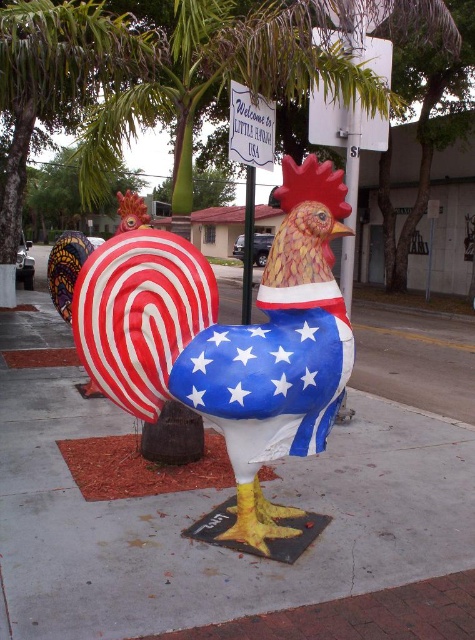
You are a delivery person with a 1.5 meter wide cart. You need to navigate through the space between the painted concrete sidewalk at center and the metallic pole at center. Can your cart fit through this space?

The painted concrete sidewalk at center might be wider than the metallic pole at center, so the space between them could be sufficient for the cart. However, since the exact width isn not specified, it is uncertain whether the 1.5 meter wide cart will fit without further measurement.

You are a delivery person who needs to place a package on the ground near the rooster sculpture. The package requires a stable surface that is at least 1.2 meters in height to avoid flooding during rain. Can the painted concrete sidewalk at center or the metallic pole at center provide this height?

The metallic pole at center is taller than the painted concrete sidewalk at center. Since the package needs a surface at least 1.2 meters high, the metallic pole at center might be suitable if its height meets the requirement, but the painted concrete sidewalk at center is shorter and likely insufficient.

You are a pedestrian walking on the sidewalk and see the painted fabric rooster at center and the white plastic sign at upper center. Which object is closer to the ground?

The painted fabric rooster at center is closer to the ground because it is below the white plastic sign at upper center.